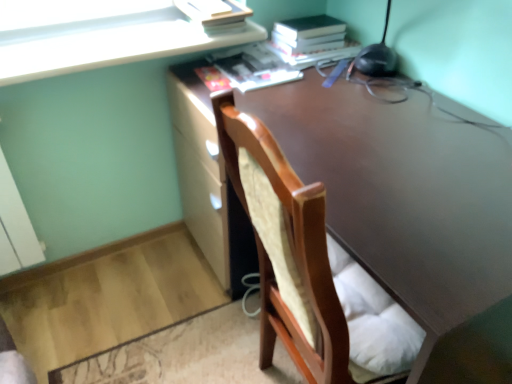
Question: Is hardcover book at upper right, which is the first paperback book in right-to-left order, closer to the viewer compared to matte paper book at upper center?

Choices:
 (A) yes
 (B) no

Answer: (B)

Question: From the image's perspective, is hardcover book at upper right, which is the first paperback book in right-to-left order, on top of matte paper book at upper center?

Choices:
 (A) yes
 (B) no

Answer: (A)

Question: From the image's perspective, would you say hardcover book at upper right, marked as the second paperback book in a left-to-right arrangement, is shown under matte paper book at upper center?

Choices:
 (A) yes
 (B) no

Answer: (B)

Question: From a real-world perspective, is hardcover book at upper right, marked as the second paperback book in a left-to-right arrangement, beneath matte paper book at upper center?

Choices:
 (A) yes
 (B) no

Answer: (B)

Question: Considering the relative sizes of hardcover book at upper right, which is the first paperback book in right-to-left order, and matte paper book at upper center in the image provided, is hardcover book at upper right, which is the first paperback book in right-to-left order, taller than matte paper book at upper center?

Choices:
 (A) no
 (B) yes

Answer: (B)

Question: Is matte paper book at upper center taller than matte yellow paperback book at upper center, which ranks as the 2th paperback book in right-to-left order?

Choices:
 (A) yes
 (B) no

Answer: (B)

Question: Can you confirm if matte paper book at upper center is bigger than matte yellow paperback book at upper center, which ranks as the 2th paperback book in right-to-left order?

Choices:
 (A) yes
 (B) no

Answer: (B)

Question: From a real-world perspective, is matte paper book at upper center on top of matte yellow paperback book at upper center, which ranks as the 2th paperback book in right-to-left order?

Choices:
 (A) yes
 (B) no

Answer: (B)

Question: Is matte paper book at upper center positioned far away from matte yellow paperback book at upper center, which ranks as the 2th paperback book in right-to-left order?

Choices:
 (A) no
 (B) yes

Answer: (A)

Question: Considering the relative positions of matte paper book at upper center and matte yellow paperback book at upper center, which ranks as the 2th paperback book in right-to-left order, in the image provided, is matte paper book at upper center to the right of matte yellow paperback book at upper center, which ranks as the 2th paperback book in right-to-left order, from the viewer's perspective?

Choices:
 (A) yes
 (B) no

Answer: (A)

Question: Does matte paper book at upper center contain matte yellow paperback book at upper center, which is the first paperback book from left to right?

Choices:
 (A) no
 (B) yes

Answer: (A)

Question: Does matte yellow paperback book at upper center, which ranks as the 2th paperback book in right-to-left order, have a greater width compared to hardcover book at upper right, which is the first paperback book in right-to-left order?

Choices:
 (A) yes
 (B) no

Answer: (B)